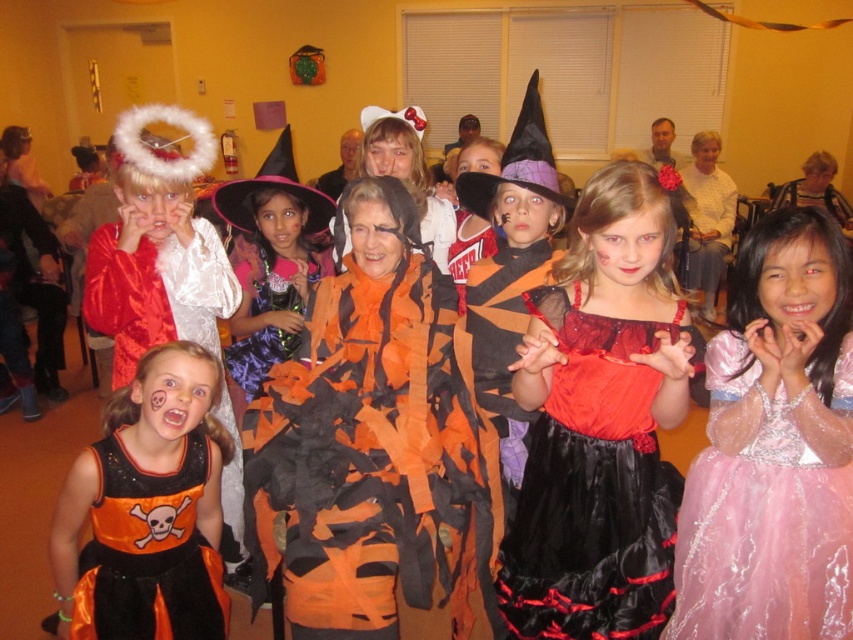
Based on the photo, you are a photographer at the Halloween gathering and want to capture a photo of the orange satin dress at center. According to the coordinates provided, where should you focus your camera?

You should focus your camera at point (258,355) to capture the orange satin dress at center.